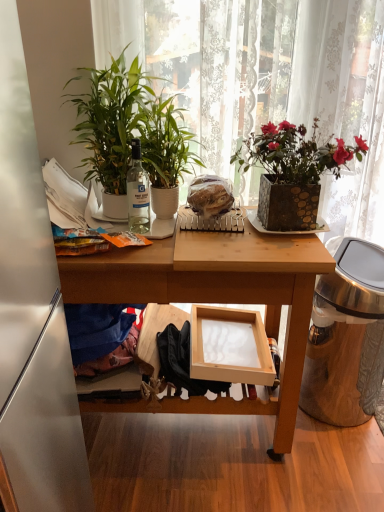
Question: Is clear glass bottle at center completely or partially outside of blue cotton clothing at lower left?

Choices:
 (A) yes
 (B) no

Answer: (A)

Question: From the image's perspective, is clear glass bottle at center over blue cotton clothing at lower left?

Choices:
 (A) yes
 (B) no

Answer: (A)

Question: Considering the relative sizes of clear glass bottle at center and blue cotton clothing at lower left in the image provided, is clear glass bottle at center shorter than blue cotton clothing at lower left?

Choices:
 (A) yes
 (B) no

Answer: (B)

Question: From a real-world perspective, is clear glass bottle at center physically below blue cotton clothing at lower left?

Choices:
 (A) yes
 (B) no

Answer: (B)

Question: Is clear glass bottle at center bigger than blue cotton clothing at lower left?

Choices:
 (A) yes
 (B) no

Answer: (B)

Question: Is clear glass bottle at center to the right of blue cotton clothing at lower left from the viewer's perspective?

Choices:
 (A) yes
 (B) no

Answer: (A)

Question: Considering the relative positions of wooden table at center and green leafy plant at center, placed as the first houseplant when sorted from right to left, in the image provided, is wooden table at center in front of green leafy plant at center, placed as the first houseplant when sorted from right to left,?

Choices:
 (A) yes
 (B) no

Answer: (A)

Question: From a real-world perspective, is wooden table at center over green leafy plant at center, placed as the first houseplant when sorted from right to left?

Choices:
 (A) no
 (B) yes

Answer: (A)

Question: Does wooden table at center lie behind green leafy plant at center, placed as the first houseplant when sorted from right to left?

Choices:
 (A) yes
 (B) no

Answer: (B)

Question: Is wooden table at center completely or partially outside of green leafy plant at center, placed as the first houseplant when sorted from right to left?

Choices:
 (A) yes
 (B) no

Answer: (A)

Question: Considering the relative sizes of wooden table at center and green leafy plant at center, placed as the first houseplant when sorted from right to left, in the image provided, is wooden table at center taller than green leafy plant at center, placed as the first houseplant when sorted from right to left,?

Choices:
 (A) no
 (B) yes

Answer: (B)

Question: Is the surface of wooden table at center in direct contact with green leafy plant at center, placed as the first houseplant when sorted from right to left?

Choices:
 (A) yes
 (B) no

Answer: (B)

Question: Considering the relative sizes of wooden frame at lower center and translucent plastic bread at center in the image provided, is wooden frame at lower center smaller than translucent plastic bread at center?

Choices:
 (A) yes
 (B) no

Answer: (B)